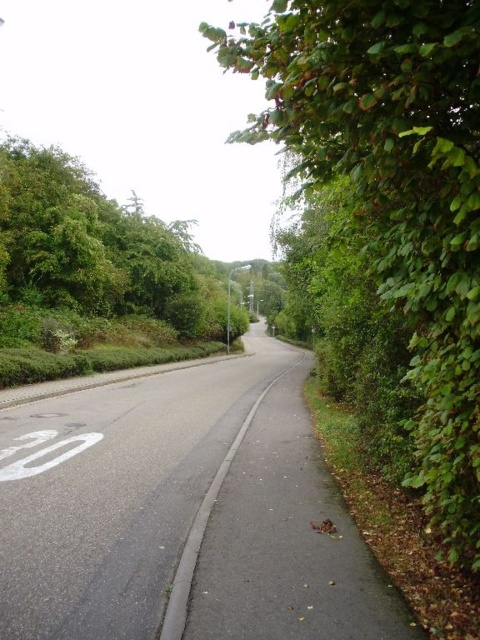
Does point (478, 115) come closer to viewer compared to point (48, 250)?

Yes, it is in front of point (48, 250).

Does point (460, 490) come closer to viewer compared to point (90, 304)?

Yes, point (460, 490) is in front of point (90, 304).

This screenshot has height=640, width=480. Identify the location of green leafy tree at right. (395, 186).